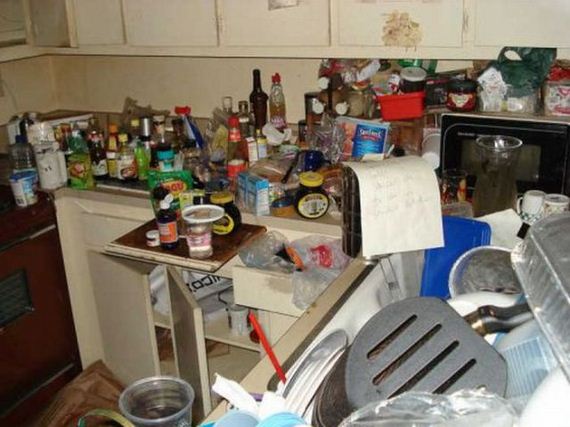
This screenshot has width=570, height=427. Identify the location of oven door. pyautogui.click(x=13, y=304).